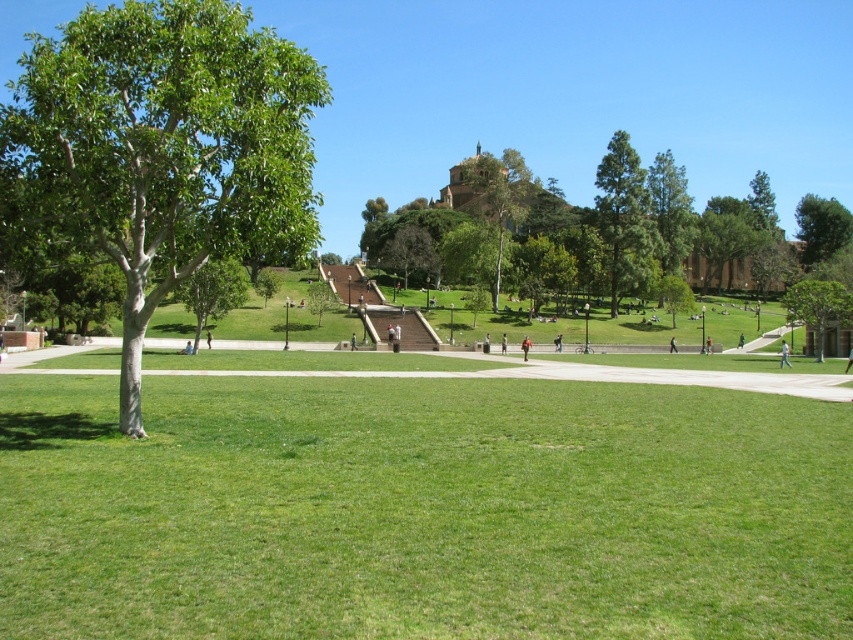
Is the position of green grassy field at center more distant than that of light blue jeans at lower right?

No.

Is green grassy field at center thinner than light blue jeans at lower right?

No, green grassy field at center is not thinner than light blue jeans at lower right.

Where is `green grassy field at center`? green grassy field at center is located at coordinates (421, 509).

Looking at this image, does green leafy tree at center-left appear under light brown wooden bench at center?

No.

Between green leafy tree at center-left and light brown wooden bench at center, which one appears on the right side from the viewer's perspective?

light brown wooden bench at center is more to the right.

Between point (229, 272) and point (354, 348), which one is positioned behind?

The point (354, 348) is behind.

The width and height of the screenshot is (853, 640). Identify the location of green leafy tree at center-left. (212, 291).

Does point (666, 154) lie behind point (840, 218)?

No, (666, 154) is in front of (840, 218).

Which of these two, green leafy tree at upper center or green leafy tree at upper right, stands shorter?

Standing shorter between the two is green leafy tree at upper right.

Identify the location of green leafy tree at upper center. This screenshot has height=640, width=853. (675, 227).